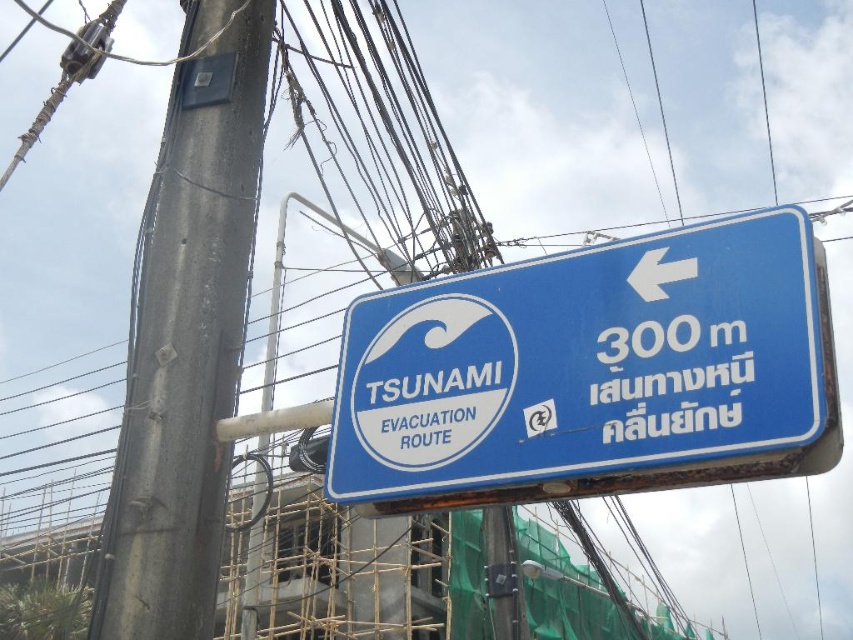
Question: Observing the image, what is the correct spatial positioning of blue plastic sign at upper center in reference to gray concrete pole at left?

Choices:
 (A) below
 (B) above

Answer: (A)

Question: Does blue plastic sign at upper center appear under gray concrete pole at left?

Choices:
 (A) no
 (B) yes

Answer: (B)

Question: Where is blue plastic sign at upper center located in relation to gray concrete pole at left in the image?

Choices:
 (A) left
 (B) right

Answer: (B)

Question: Which point appears closest to the camera in this image?

Choices:
 (A) (396, 387)
 (B) (196, 259)

Answer: (A)